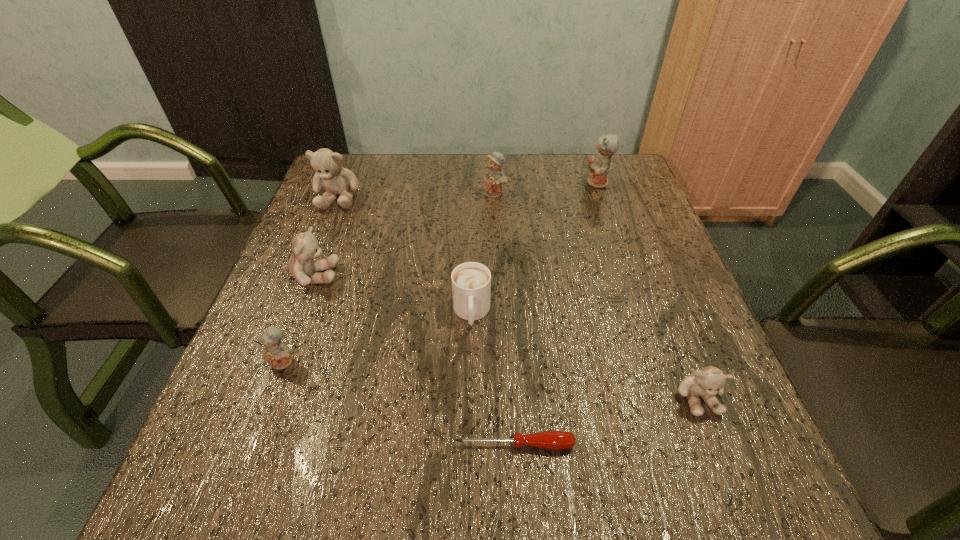
I want to click on gray teddy bear that stands as the second closest to the nearest object, so click(x=305, y=247).

Identify which gray teddy bear is located as the nearest to the red screwdriver. Please provide its 2D coordinates. Your answer should be formatted as a tuple, i.e. [(x, y)], where the tuple contains the x and y coordinates of a point satisfying the conditions above.

[(707, 382)]

What are the coordinates of `vacant position in the image that satisfies the following two spatial constraints: 1. on the face of the second smallest gray teddy bear; 2. on the back side of the screwdriver` in the screenshot? It's located at (249, 444).

Identify the location of vacant space that satisfies the following two spatial constraints: 1. on the side with the handle of the fourth nearest object; 2. on the left side of the screwdriver. (469, 444).

I want to click on vacant area in the image that satisfies the following two spatial constraints: 1. on the side with the handle of the fourth nearest object; 2. on the right side of the nearest object, so click(x=469, y=444).

This screenshot has width=960, height=540. In order to click on free space in the image that satisfies the following two spatial constraints: 1. on the face of the farthest gray teddy bear; 2. on the right side of the screwdriver in this screenshot , I will do `click(241, 444)`.

Find the location of a particular element. free space that satisfies the following two spatial constraints: 1. on the face of the shortest object; 2. on the right side of the third nearest teddy bear is located at coordinates (249, 444).

Where is `vacant space that satisfies the following two spatial constraints: 1. on the front-facing side of the biggest blue teddy bear; 2. on the front-facing side of the third nearest object`? This screenshot has width=960, height=540. vacant space that satisfies the following two spatial constraints: 1. on the front-facing side of the biggest blue teddy bear; 2. on the front-facing side of the third nearest object is located at coordinates (659, 362).

I want to click on blank area in the image that satisfies the following two spatial constraints: 1. on the front-facing side of the biggest blue teddy bear; 2. on the front-facing side of the smallest blue teddy bear, so click(x=659, y=362).